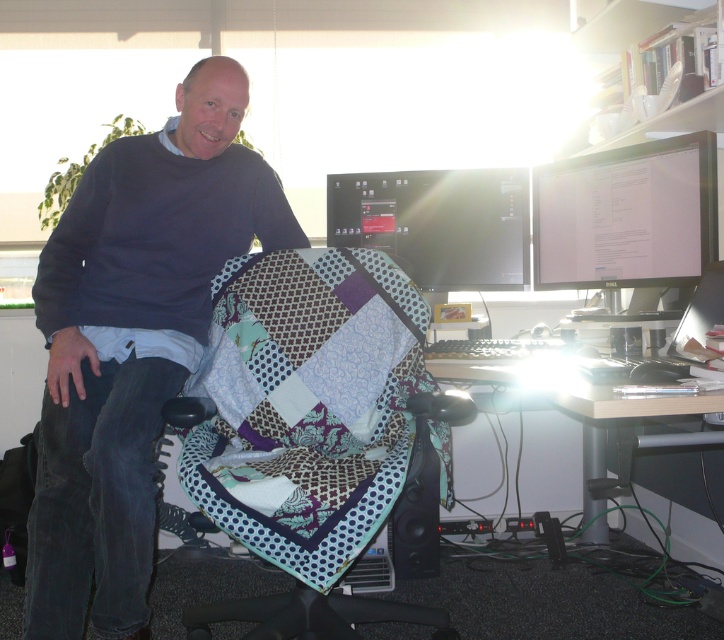
Question: Which point is farther to the camera?

Choices:
 (A) click(707, 205)
 (B) click(509, 256)
 (C) click(290, 440)
 (D) click(274, 212)

Answer: (B)

Question: Is dark blue sweater at center above patchwork fabric swivel chair at center?

Choices:
 (A) yes
 (B) no

Answer: (A)

Question: Which of these objects is positioned closest to the wooden desk at lower right?

Choices:
 (A) matte black monitor at center
 (B) patchwork fabric swivel chair at center
 (C) matte black monitor at upper right

Answer: (B)

Question: Does dark blue sweater at center appear over wooden desk at lower right?

Choices:
 (A) yes
 (B) no

Answer: (A)

Question: Does patchwork fabric swivel chair at center have a smaller size compared to wooden desk at lower right?

Choices:
 (A) yes
 (B) no

Answer: (B)

Question: Which of the following is the farthest from the observer?

Choices:
 (A) dark blue sweater at center
 (B) matte black monitor at upper right
 (C) wooden desk at lower right
 (D) patchwork fabric swivel chair at center

Answer: (B)